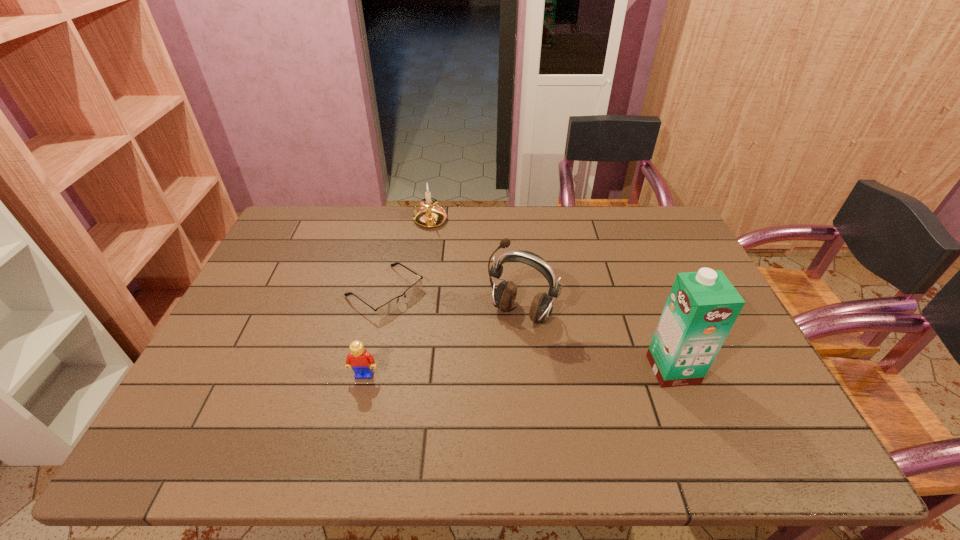
Identify the location of the second shortest object. (361, 361).

Where is `the rightmost object`? The height and width of the screenshot is (540, 960). the rightmost object is located at coordinates (702, 307).

Locate an element on the screen. Image resolution: width=960 pixels, height=540 pixels. carton is located at coordinates coord(702,307).

Identify the location of spectacles. (387, 308).

Identify the location of the fourth shortest object. (504, 296).

I want to click on the second object from right to left, so click(x=504, y=296).

What are the coordinates of `the farthest object` in the screenshot? It's located at (429, 215).

Locate an element on the screen. The image size is (960, 540). candle holder is located at coordinates (429, 215).

Locate an element on the screen. vacant region located 0.200m on the back of the rightmost object is located at coordinates (644, 298).

Locate an element on the screen. The width and height of the screenshot is (960, 540). vacant space situated on the front-facing side of the shortest object is located at coordinates (442, 332).